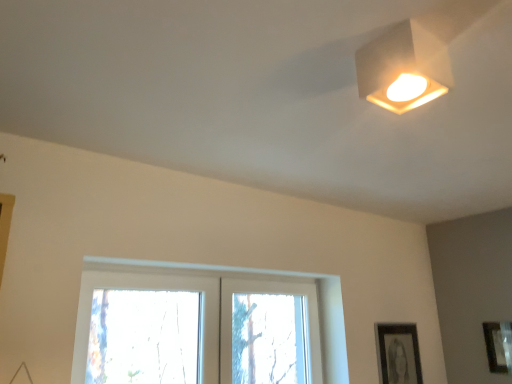
Question: Is white matte square lamp at upper right at the back of matte black picture frame at lower right, the 2th picture frame in the left-to-right sequence?

Choices:
 (A) no
 (B) yes

Answer: (A)

Question: Considering the relative sizes of matte black picture frame at lower right, the 2th picture frame in the left-to-right sequence, and white matte square lamp at upper right in the image provided, is matte black picture frame at lower right, the 2th picture frame in the left-to-right sequence, wider than white matte square lamp at upper right?

Choices:
 (A) no
 (B) yes

Answer: (A)

Question: From the image's perspective, is matte black picture frame at lower right, the 2th picture frame in the left-to-right sequence, under white matte square lamp at upper right?

Choices:
 (A) yes
 (B) no

Answer: (A)

Question: Can you confirm if matte black picture frame at lower right, the first picture frame from the right, is shorter than white matte square lamp at upper right?

Choices:
 (A) no
 (B) yes

Answer: (A)

Question: Does matte black picture frame at lower right, the 2th picture frame in the left-to-right sequence, turn towards white matte square lamp at upper right?

Choices:
 (A) no
 (B) yes

Answer: (B)

Question: Can you confirm if matte black picture frame at lower right, the 2th picture frame in the left-to-right sequence, is positioned to the right of white matte square lamp at upper right?

Choices:
 (A) yes
 (B) no

Answer: (A)

Question: Could you tell me if black matte picture frame at lower right, the first picture frame in the left-to-right sequence, is turned towards clear glass window at center?

Choices:
 (A) yes
 (B) no

Answer: (B)

Question: From the image's perspective, does black matte picture frame at lower right, the first picture frame in the left-to-right sequence, appear lower than clear glass window at center?

Choices:
 (A) no
 (B) yes

Answer: (B)

Question: Considering the relative sizes of black matte picture frame at lower right, which is the 2th picture frame in right-to-left order, and clear glass window at center in the image provided, is black matte picture frame at lower right, which is the 2th picture frame in right-to-left order, taller than clear glass window at center?

Choices:
 (A) yes
 (B) no

Answer: (B)

Question: Is black matte picture frame at lower right, which is the 2th picture frame in right-to-left order, next to clear glass window at center and touching it?

Choices:
 (A) yes
 (B) no

Answer: (B)

Question: Is black matte picture frame at lower right, which is the 2th picture frame in right-to-left order, positioned before clear glass window at center?

Choices:
 (A) yes
 (B) no

Answer: (B)

Question: Does black matte picture frame at lower right, the first picture frame in the left-to-right sequence, come behind clear glass window at center?

Choices:
 (A) yes
 (B) no

Answer: (A)

Question: Is white matte square lamp at upper right not close to black matte picture frame at lower right, the first picture frame in the left-to-right sequence?

Choices:
 (A) yes
 (B) no

Answer: (A)